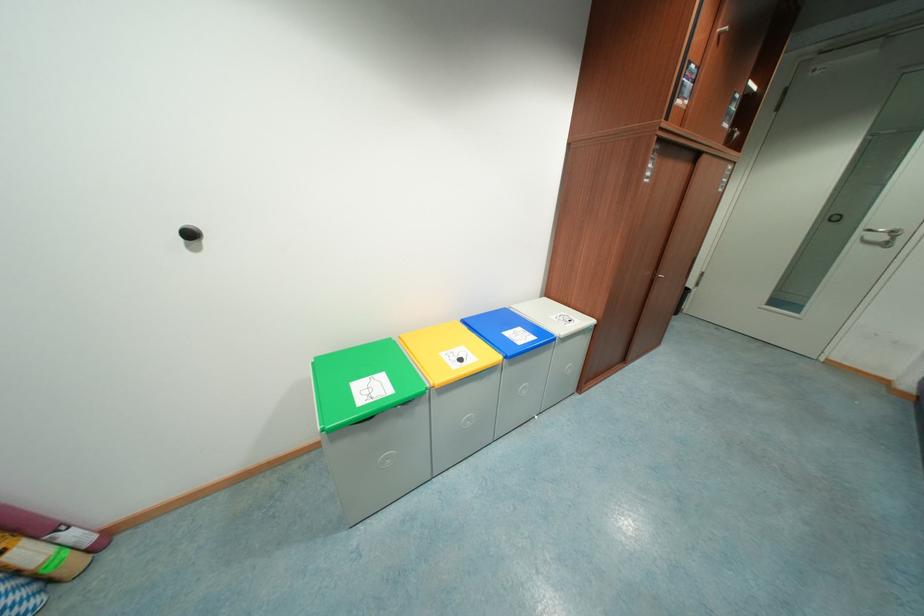
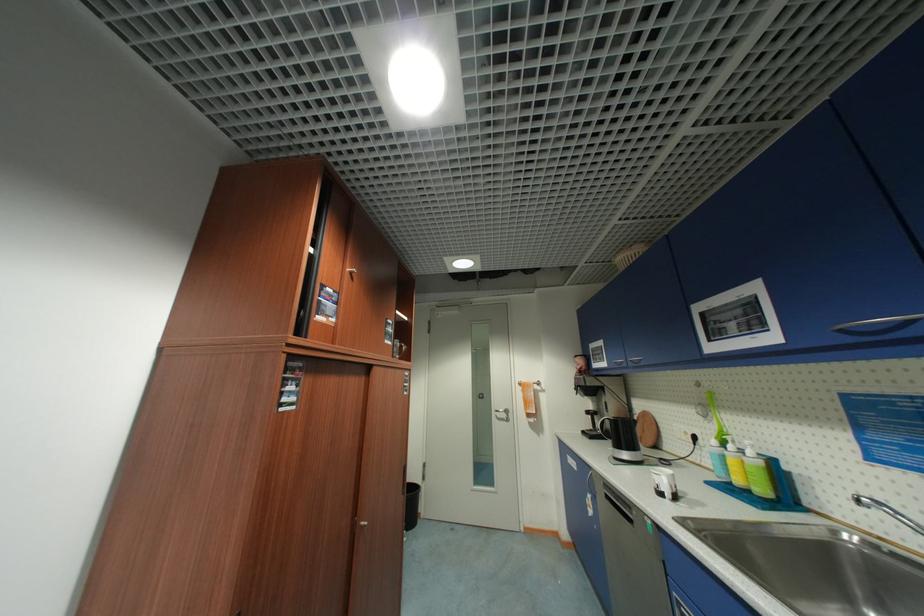
The first image is from the beginning of the video and the second image is from the end. How did the camera likely rotate when shooting the video?

The camera rotated toward right-up.